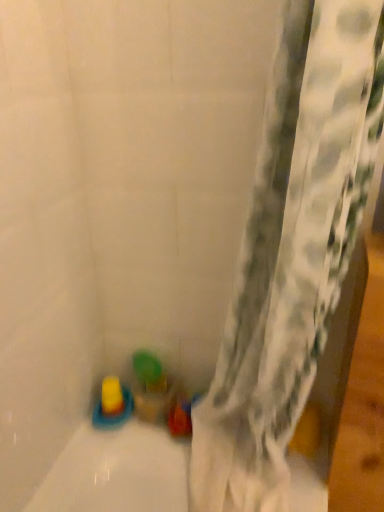
Question: From the image's perspective, does yellow rubber toy at lower left, arranged as the first toy when viewed from the left, appear lower than translucent plastic cup at lower center, positioned as the first toy in right-to-left order?

Choices:
 (A) no
 (B) yes

Answer: (A)

Question: Is yellow rubber toy at lower left, arranged as the first toy when viewed from the left, oriented away from translucent plastic cup at lower center, the third toy from the left?

Choices:
 (A) no
 (B) yes

Answer: (A)

Question: Does yellow rubber toy at lower left, arranged as the first toy when viewed from the left, come in front of translucent plastic cup at lower center, positioned as the first toy in right-to-left order?

Choices:
 (A) yes
 (B) no

Answer: (B)

Question: Considering the relative sizes of yellow rubber toy at lower left, marked as the 3th toy in a right-to-left arrangement, and translucent plastic cup at lower center, positioned as the first toy in right-to-left order, in the image provided, is yellow rubber toy at lower left, marked as the 3th toy in a right-to-left arrangement, wider than translucent plastic cup at lower center, positioned as the first toy in right-to-left order,?

Choices:
 (A) yes
 (B) no

Answer: (A)

Question: Is yellow rubber toy at lower left, arranged as the first toy when viewed from the left, not inside translucent plastic cup at lower center, positioned as the first toy in right-to-left order?

Choices:
 (A) no
 (B) yes

Answer: (B)

Question: Looking at their shapes, would you say translucent plastic cup at lower center, the third toy from the left, is wider or thinner than translucent yellow toy at bottom left, which is counted as the second toy, starting from the left?

Choices:
 (A) wide
 (B) thin

Answer: (B)

Question: Do you think translucent plastic cup at lower center, positioned as the first toy in right-to-left order, is within translucent yellow toy at bottom left, the 2th toy when ordered from right to left, or outside of it?

Choices:
 (A) outside
 (B) inside

Answer: (A)

Question: From their relative heights in the image, would you say translucent plastic cup at lower center, positioned as the first toy in right-to-left order, is taller or shorter than translucent yellow toy at bottom left, which is counted as the second toy, starting from the left?

Choices:
 (A) tall
 (B) short

Answer: (A)

Question: From the image's perspective, is translucent plastic cup at lower center, the third toy from the left, located above or below translucent yellow toy at bottom left, which is counted as the second toy, starting from the left?

Choices:
 (A) above
 (B) below

Answer: (A)

Question: Is point (155, 400) positioned closer to the camera than point (117, 396)?

Choices:
 (A) farther
 (B) closer

Answer: (A)

Question: Is translucent plastic cup at lower center, the third toy from the left, inside the boundaries of yellow rubber toy at lower left, arranged as the first toy when viewed from the left, or outside?

Choices:
 (A) outside
 (B) inside

Answer: (A)

Question: Considering the positions of translucent plastic cup at lower center, positioned as the first toy in right-to-left order, and yellow rubber toy at lower left, marked as the 3th toy in a right-to-left arrangement, in the image, is translucent plastic cup at lower center, positioned as the first toy in right-to-left order, taller or shorter than yellow rubber toy at lower left, marked as the 3th toy in a right-to-left arrangement,?

Choices:
 (A) tall
 (B) short

Answer: (A)

Question: Relative to yellow rubber toy at lower left, marked as the 3th toy in a right-to-left arrangement, is translucent plastic cup at lower center, positioned as the first toy in right-to-left order, in front or behind?

Choices:
 (A) behind
 (B) front

Answer: (B)

Question: From their relative heights in the image, would you say yellow rubber toy at lower left, arranged as the first toy when viewed from the left, is taller or shorter than translucent plastic cup at lower center, the third toy from the left?

Choices:
 (A) tall
 (B) short

Answer: (B)

Question: Considering the relative positions of yellow rubber toy at lower left, marked as the 3th toy in a right-to-left arrangement, and translucent plastic cup at lower center, the third toy from the left, in the image provided, is yellow rubber toy at lower left, marked as the 3th toy in a right-to-left arrangement, to the left or to the right of translucent plastic cup at lower center, the third toy from the left,?

Choices:
 (A) right
 (B) left

Answer: (B)